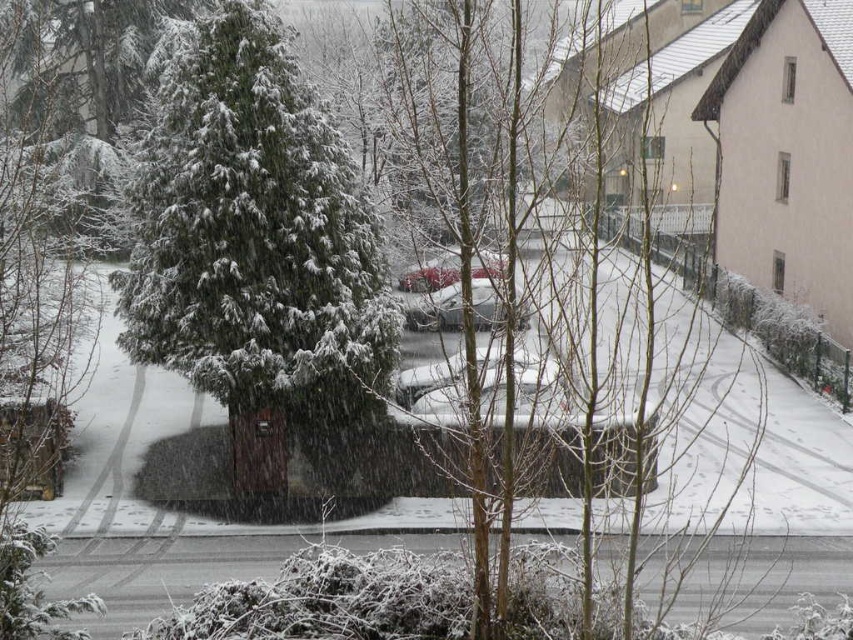
Can you confirm if shiny silver car at center is shorter than metallic red car at center?

Indeed, shiny silver car at center has a lesser height compared to metallic red car at center.

This screenshot has width=853, height=640. Describe the element at coordinates (434, 308) in the screenshot. I see `shiny silver car at center` at that location.

You are a GUI agent. You are given a task and a screenshot of the screen. Output one action in this format:
    pyautogui.click(x=<x>, y=<y>)
    Task: Click on the shiny silver car at center
    
    Given the screenshot: What is the action you would take?
    pyautogui.click(x=434, y=308)

Is green matte evergreen tree at left behind shiny silver car at center?

Yes, green matte evergreen tree at left is behind shiny silver car at center.

Does green matte evergreen tree at left appear on the right side of shiny silver car at center?

No, green matte evergreen tree at left is not to the right of shiny silver car at center.

What do you see at coordinates (259, 259) in the screenshot? I see `green matte evergreen tree at left` at bounding box center [259, 259].

You are a GUI agent. You are given a task and a screenshot of the screen. Output one action in this format:
    pyautogui.click(x=<x>, y=<y>)
    Task: Click on the green matte evergreen tree at left
    The height and width of the screenshot is (640, 853).
    Given the screenshot: What is the action you would take?
    pyautogui.click(x=259, y=259)

Can you confirm if green matte evergreen tree at left is thinner than metallic red car at center?

Indeed, green matte evergreen tree at left has a lesser width compared to metallic red car at center.

Measure the distance between point (309, 128) and camera.

The distance of point (309, 128) from camera is 21.10 meters.

Image resolution: width=853 pixels, height=640 pixels. Find the location of `green matte evergreen tree at left`. green matte evergreen tree at left is located at coordinates (259, 259).